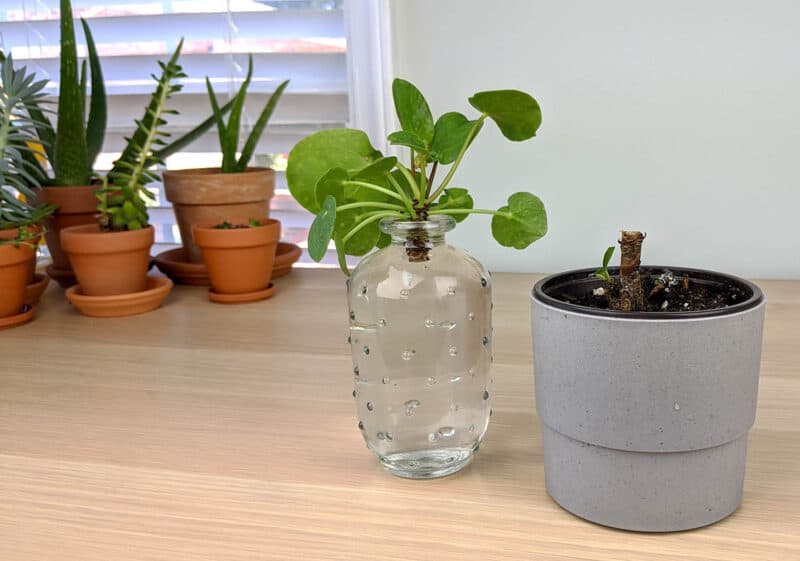
Identify the location of grey pot. The width and height of the screenshot is (800, 561). (630, 446).